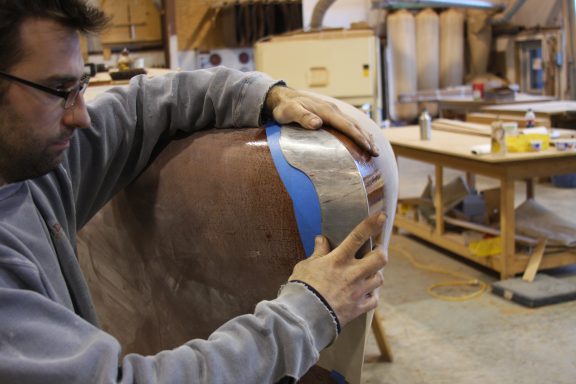
Image resolution: width=576 pixels, height=384 pixels. I want to click on wooden boards, so click(189, 20), click(151, 27).